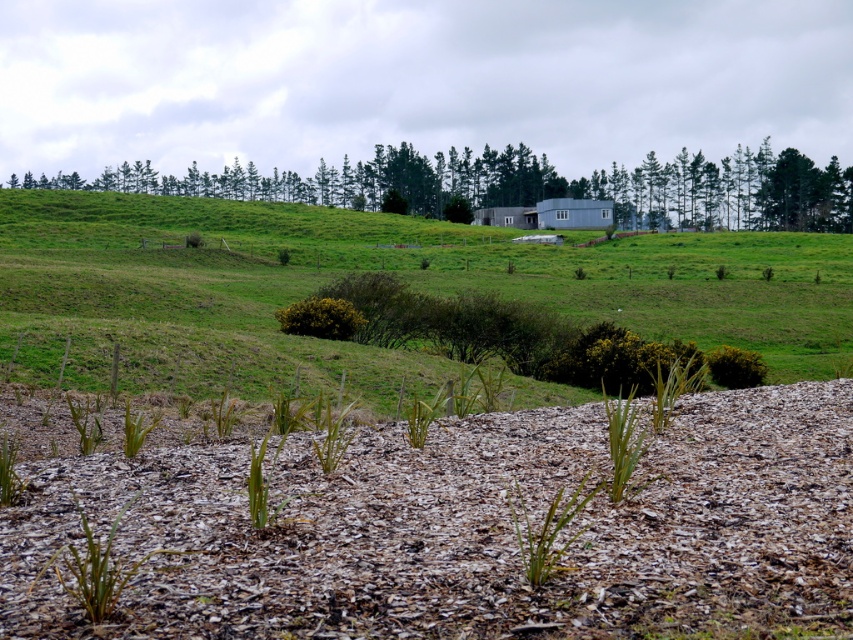
Measure the distance between brown mulch at center and camera.

brown mulch at center is 4.66 meters from camera.

Does brown mulch at center have a larger size compared to green leafy tree at upper center?

Answer: No, brown mulch at center is not bigger than green leafy tree at upper center.

Based on the photo, who is more distant from viewer, (120, 605) or (836, 168)?

The point (836, 168) is behind.

Where is `brown mulch at center`? The image size is (853, 640). brown mulch at center is located at coordinates (468, 531).

From the picture: Does green grassy hillside at upper center have a lesser width compared to green leafy tree at upper center?

Correct, green grassy hillside at upper center's width is less than green leafy tree at upper center's.

Which is behind, point (41, 368) or point (223, 196)?

The point (223, 196) is more distant.

Where is `green grassy hillside at upper center`? green grassy hillside at upper center is located at coordinates (376, 272).

Describe the element at coordinates (468, 531) in the screenshot. I see `brown mulch at center` at that location.

Does brown mulch at center lie in front of green grassy hillside at upper center?

Yes, it is in front of green grassy hillside at upper center.

Find the location of a particular element. brown mulch at center is located at coordinates (468, 531).